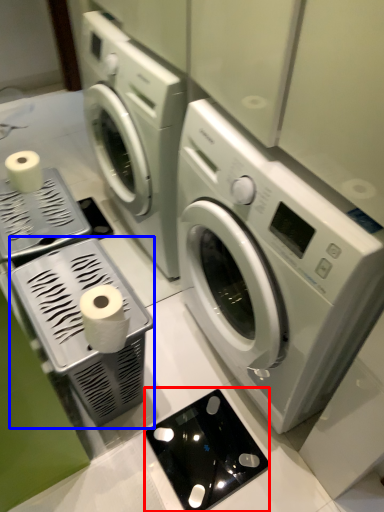
Question: Which of the following is the closest to the observer, appliance (highlighted by a red box) or appliance (highlighted by a blue box)?

Choices:
 (A) appliance
 (B) appliance

Answer: (B)